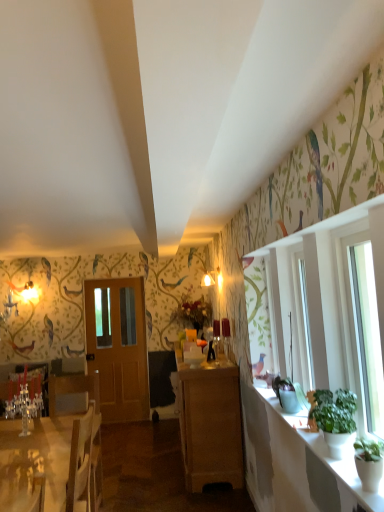
Question: From a real-world perspective, is green leafy plant at right located beneath wooden armchair at left?

Choices:
 (A) no
 (B) yes

Answer: (A)

Question: Can you confirm if green leafy plant at right is taller than wooden armchair at left?

Choices:
 (A) yes
 (B) no

Answer: (B)

Question: Is green leafy plant at right directly adjacent to wooden armchair at left?

Choices:
 (A) no
 (B) yes

Answer: (A)

Question: Can you confirm if green leafy plant at right is shorter than wooden armchair at left?

Choices:
 (A) yes
 (B) no

Answer: (A)

Question: Does green leafy plant at right come in front of wooden armchair at left?

Choices:
 (A) no
 (B) yes

Answer: (B)

Question: Can you confirm if green leafy plant at right is bigger than wooden armchair at left?

Choices:
 (A) yes
 (B) no

Answer: (B)

Question: Considering the relative sizes of white glossy desk at lower left and light brown wooden door at center in the image provided, is white glossy desk at lower left shorter than light brown wooden door at center?

Choices:
 (A) yes
 (B) no

Answer: (A)

Question: From a real-world perspective, does white glossy desk at lower left stand above light brown wooden door at center?

Choices:
 (A) no
 (B) yes

Answer: (A)

Question: Does white glossy desk at lower left appear on the left side of light brown wooden door at center?

Choices:
 (A) yes
 (B) no

Answer: (A)

Question: Does white glossy desk at lower left have a greater height compared to light brown wooden door at center?

Choices:
 (A) no
 (B) yes

Answer: (A)

Question: Does white glossy desk at lower left lie behind light brown wooden door at center?

Choices:
 (A) no
 (B) yes

Answer: (A)

Question: Is white glossy desk at lower left with light brown wooden door at center?

Choices:
 (A) no
 (B) yes

Answer: (A)

Question: From a real-world perspective, is white glossy desk at lower left positioned under green matte plant at right based on gravity?

Choices:
 (A) no
 (B) yes

Answer: (B)